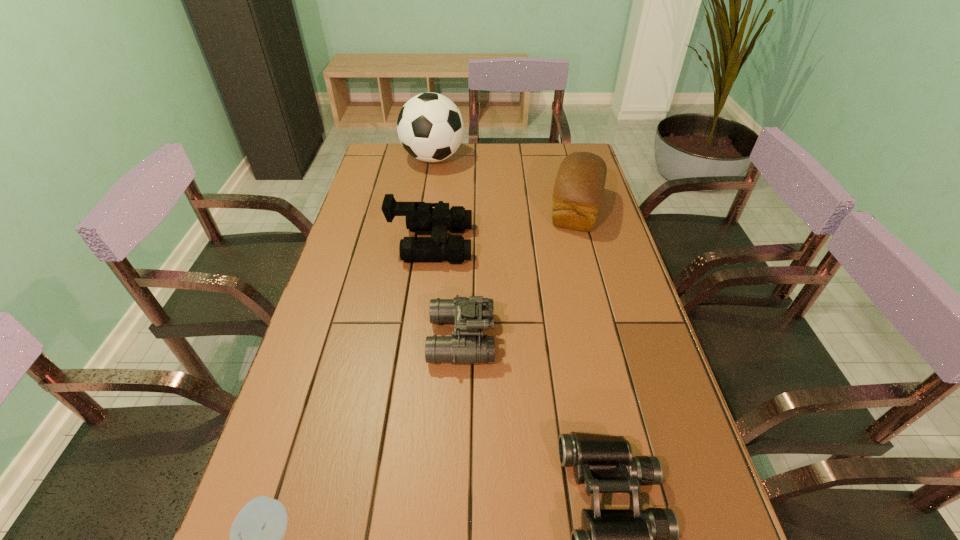
Locate an element on the screen. The width and height of the screenshot is (960, 540). the tallest object is located at coordinates (430, 126).

I want to click on the farthest object, so click(x=430, y=126).

You are a GUI agent. You are given a task and a screenshot of the screen. Output one action in this format:
    pyautogui.click(x=<x>, y=<y>)
    Task: Click on the bread
    This screenshot has height=540, width=960.
    Given the screenshot: What is the action you would take?
    579,186

The height and width of the screenshot is (540, 960). What are the coordinates of `the tallest binoculars` in the screenshot? It's located at (421, 218).

Where is `the fourth tallest object`? The image size is (960, 540). the fourth tallest object is located at coordinates (470, 316).

Identify the location of the second nearest binoculars. This screenshot has height=540, width=960. (470, 316).

At what (x,y) coordinates should I click in order to perform the action: click on free space located 0.360m on the right of the tallest object. Please return your answer as a coordinate pair (x, y). Looking at the image, I should click on (557, 158).

This screenshot has width=960, height=540. I want to click on free spot located on the left of the bread, so coord(475,210).

At what (x,y) coordinates should I click in order to perform the action: click on free space located on the front lenses of the tallest binoculars. Please return your answer as a coordinate pair (x, y). Looking at the image, I should click on (507, 244).

Find the location of a particular element. free location located 0.170m through the lenses of the third shortest object is located at coordinates click(563, 339).